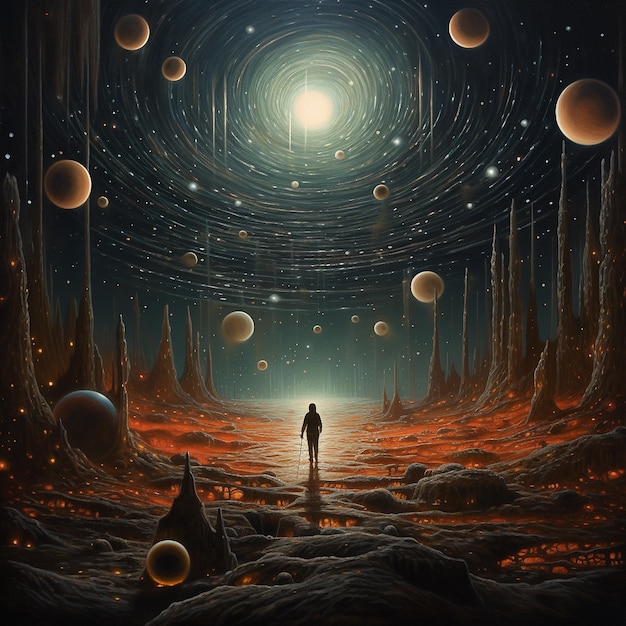
Image resolution: width=626 pixels, height=626 pixels. What are the coordinates of `white light` in the screenshot? It's located at (313, 105).